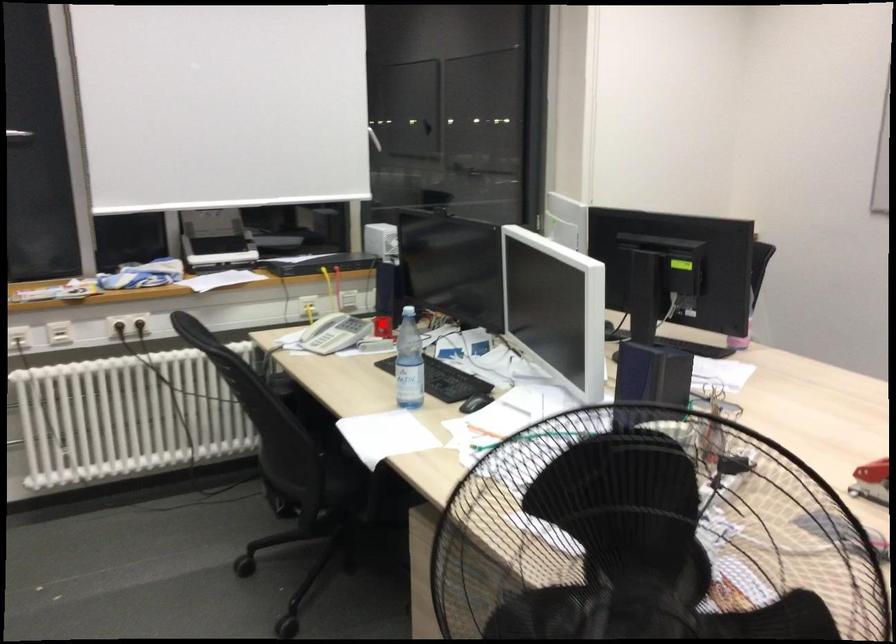
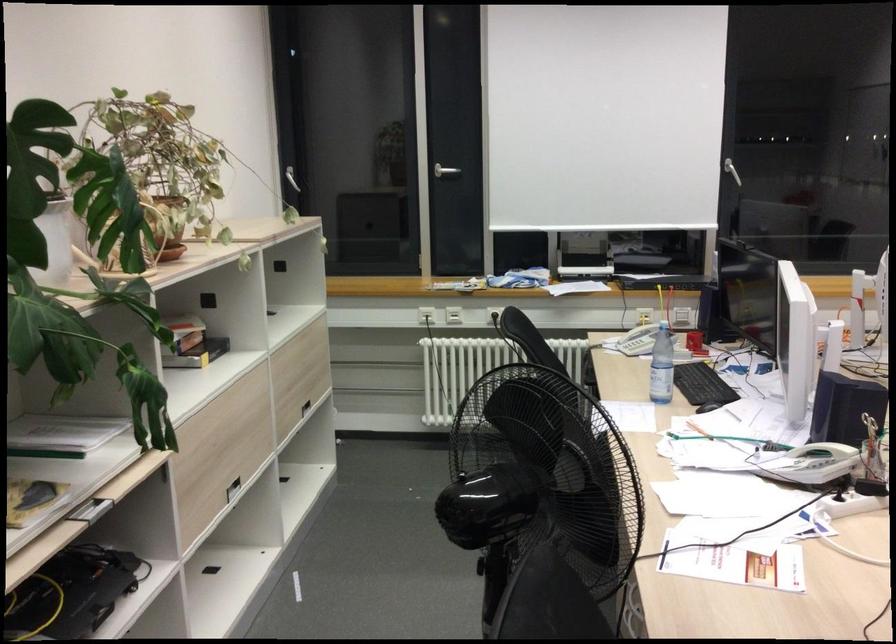
Question: I am providing you with two images of the same scene from different viewpoints. A red point is shown in image1. For the corresponding object point in image2, is it positioned nearer or farther from the camera?

Choices:
 (A) Nearer
 (B) Farther

Answer: (B)